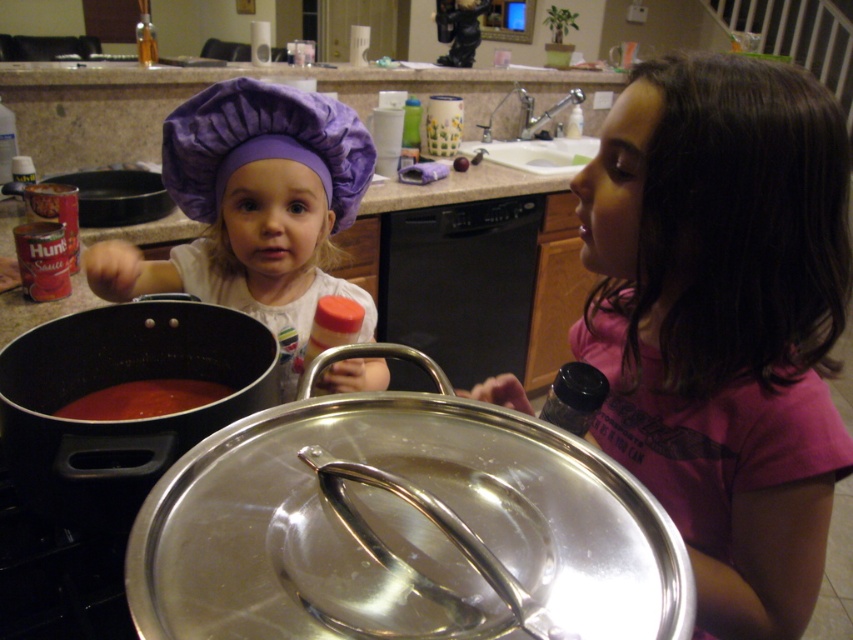
Question: Is purple fabric chef hat at upper left above smooth tomato sauce at left?

Choices:
 (A) yes
 (B) no

Answer: (A)

Question: Which point appears farthest from the camera in this image?

Choices:
 (A) (618, 157)
 (B) (141, 380)
 (C) (276, 294)

Answer: (C)

Question: Is pink fabric shirt at upper right smaller than purple fabric chef hat at upper left?

Choices:
 (A) yes
 (B) no

Answer: (B)

Question: From the image, what is the correct spatial relationship of pink fabric shirt at upper right in relation to smooth tomato sauce at left?

Choices:
 (A) above
 (B) below

Answer: (A)

Question: Which point is closer to the camera?

Choices:
 (A) pink fabric shirt at upper right
 (B) smooth tomato sauce at left

Answer: (A)

Question: Which object appears closest to the camera in this image?

Choices:
 (A) purple fabric chef hat at upper left
 (B) pink fabric shirt at upper right

Answer: (B)